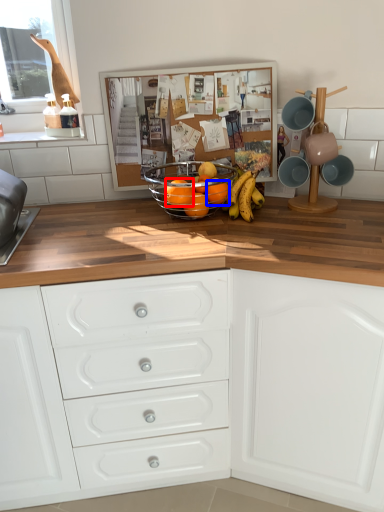
Question: Which object is closer to the camera taking this photo, orange (highlighted by a red box) or orange (highlighted by a blue box)?

Choices:
 (A) orange
 (B) orange

Answer: (A)